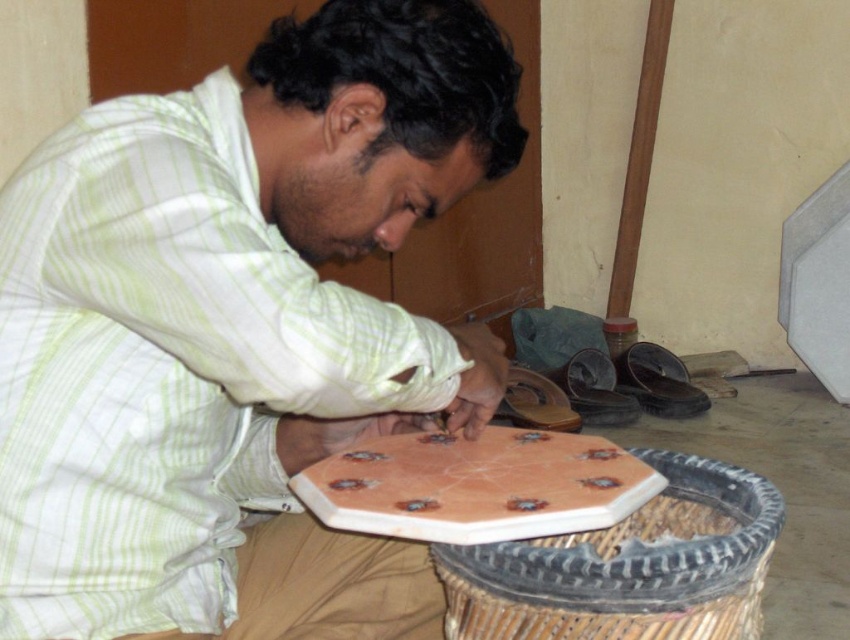
Question: Which point is closer to the camera?

Choices:
 (A) white striped shirt at center
 (B) black leather shoe at lower right
 (C) pink glossy board game at center
 (D) black rubber shoe at lower center

Answer: (A)

Question: Among these points, which one is nearest to the camera?

Choices:
 (A) (426, 356)
 (B) (374, 524)
 (C) (605, 388)
 (D) (687, 387)

Answer: (A)

Question: Considering the real-world distances, which object is farthest from the black leather shoe at lower right?

Choices:
 (A) pink glossy board game at center
 (B) black rubber shoe at lower center

Answer: (A)

Question: Is black rubber shoe at lower center behind black leather shoe at lower right?

Choices:
 (A) yes
 (B) no

Answer: (A)

Question: Is white striped shirt at center thinner than pink glossy board game at center?

Choices:
 (A) yes
 (B) no

Answer: (B)

Question: Does white striped shirt at center have a larger size compared to black rubber shoe at lower center?

Choices:
 (A) no
 (B) yes

Answer: (B)